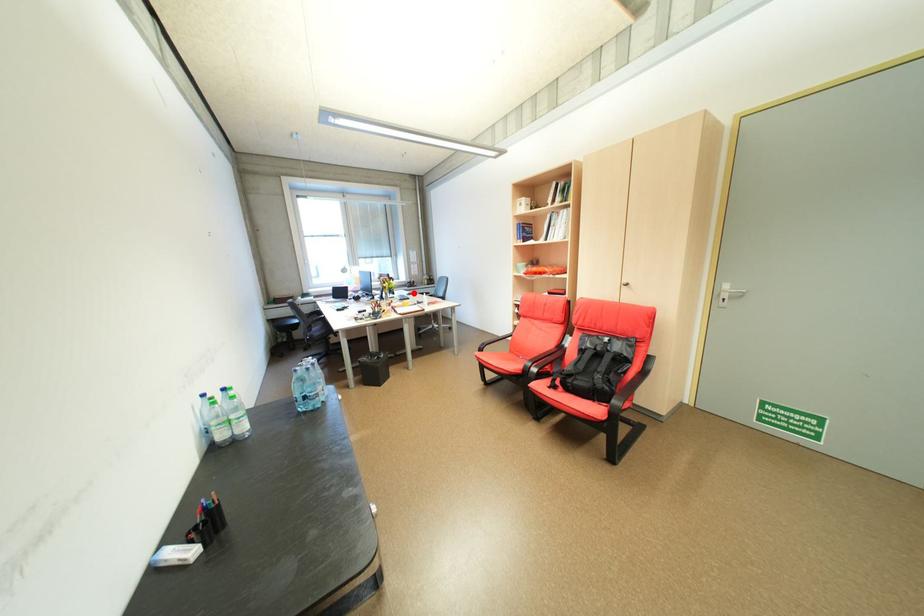
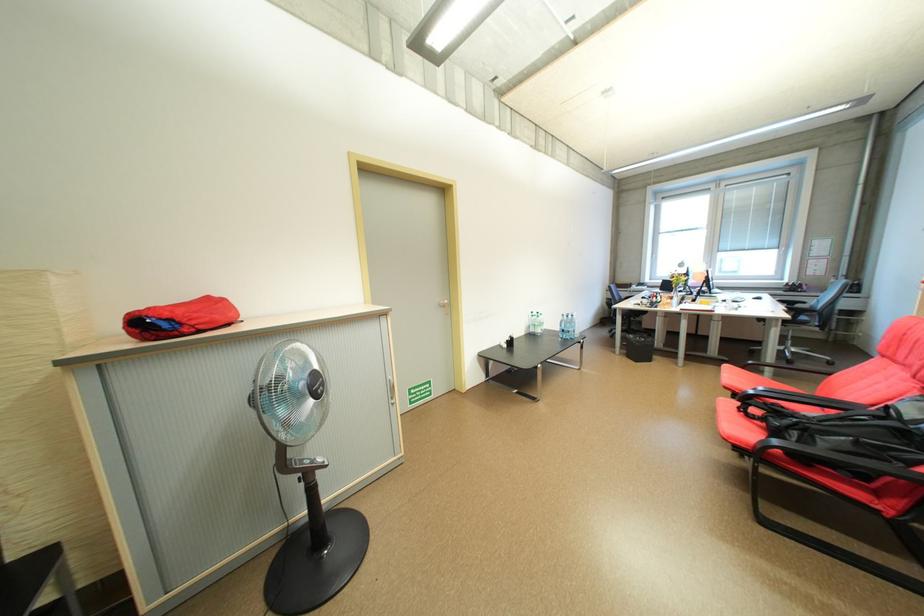
Question: I am providing you with two images of the same scene from different viewpoints. Given a red point in image1, look at the same physical point in image2. Is it:

Choices:
 (A) Closer to the viewpoint
 (B) Farther from the viewpoint

Answer: (A)